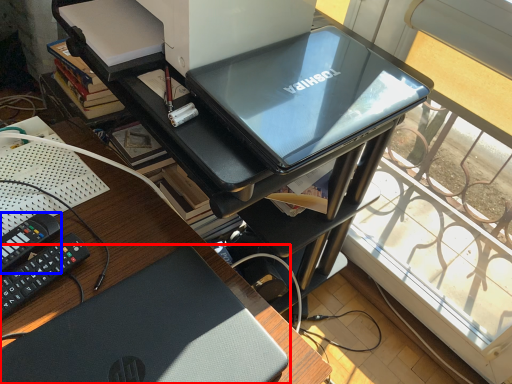
Question: Which object appears closest to the camera in this image, laptop (highlighted by a red box) or equipment (highlighted by a blue box)?

Choices:
 (A) laptop
 (B) equipment

Answer: (A)